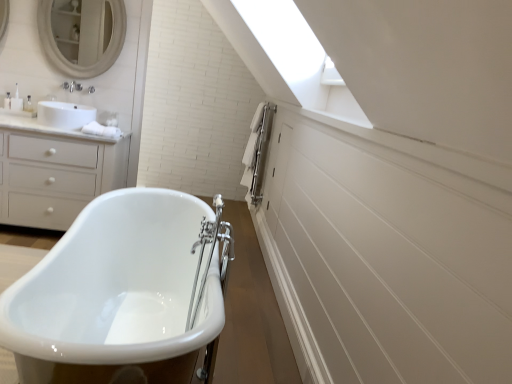
Question: Is white matte chest of drawers at left in front of white glossy bathtub at center?

Choices:
 (A) no
 (B) yes

Answer: (A)

Question: Does white matte chest of drawers at left contain white glossy bathtub at center?

Choices:
 (A) no
 (B) yes

Answer: (A)

Question: From a real-world perspective, is white matte chest of drawers at left located beneath white glossy bathtub at center?

Choices:
 (A) yes
 (B) no

Answer: (B)

Question: From the image's perspective, is white matte chest of drawers at left located above white glossy bathtub at center?

Choices:
 (A) no
 (B) yes

Answer: (B)

Question: Is white matte chest of drawers at left at the right side of white glossy bathtub at center?

Choices:
 (A) yes
 (B) no

Answer: (B)

Question: Is white matte chest of drawers at left further to the viewer compared to white glossy bathtub at center?

Choices:
 (A) yes
 (B) no

Answer: (A)

Question: Is white glossy bathtub at center turned away from white matte chest of drawers at left?

Choices:
 (A) no
 (B) yes

Answer: (A)

Question: From the image's perspective, is white glossy bathtub at center over white matte chest of drawers at left?

Choices:
 (A) no
 (B) yes

Answer: (A)

Question: Does white glossy bathtub at center appear on the left side of white matte chest of drawers at left?

Choices:
 (A) yes
 (B) no

Answer: (B)

Question: Does white glossy bathtub at center have a smaller size compared to white matte chest of drawers at left?

Choices:
 (A) no
 (B) yes

Answer: (A)

Question: Can we say white glossy bathtub at center lies outside white matte chest of drawers at left?

Choices:
 (A) no
 (B) yes

Answer: (B)

Question: Does white glossy bathtub at center have a larger size compared to white matte chest of drawers at left?

Choices:
 (A) no
 (B) yes

Answer: (B)

Question: Is white matte mirror at upper left completely or partially outside of white glossy bathtub at center?

Choices:
 (A) no
 (B) yes

Answer: (B)